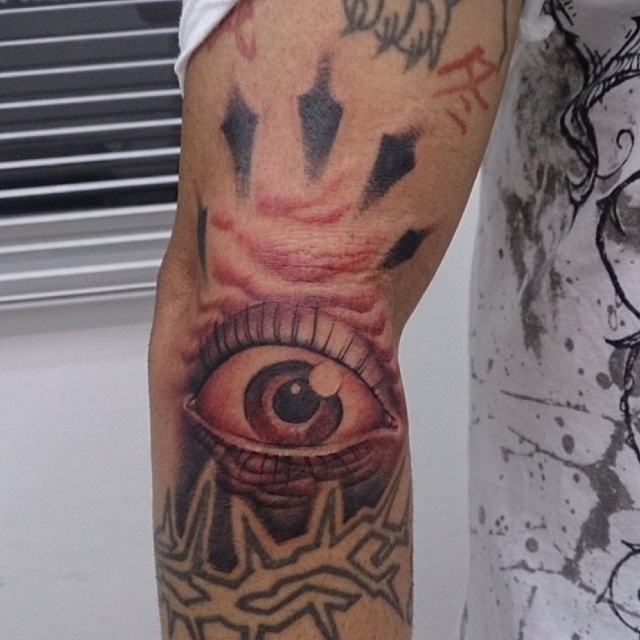
Looking at this image, you are examining the intricate tattoo on the forearm. There are two points marked in the tattoo design. The first point is at coordinates point (154, 506), and the second is at point (353, 449). From your perspective, which point appears closer to you?

Point (154, 506) is further to the viewer than point (353, 449), so the first point appears closer to you.

Based on the photo, you are an artist examining a forearm with two eyes tattooed. The black tattooed eye at center and the brown glossy eye at center are both present. Which one appears bigger?

The black tattooed eye at center is larger in size than the brown glossy eye at center.